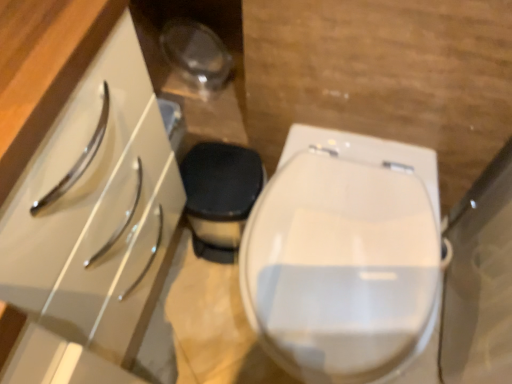
Question: From a real-world perspective, is white glossy toilet at center positioned above or below white glossy cabinet at left?

Choices:
 (A) above
 (B) below

Answer: (B)

Question: Visually, is white glossy toilet at center positioned to the left or to the right of white glossy cabinet at left?

Choices:
 (A) right
 (B) left

Answer: (A)

Question: Is point (376, 322) positioned closer to the camera than point (140, 94)?

Choices:
 (A) closer
 (B) farther

Answer: (B)

Question: Which is correct: white glossy cabinet at left is inside white glossy toilet at center, or outside of it?

Choices:
 (A) inside
 (B) outside

Answer: (B)

Question: Considering the positions of white glossy cabinet at left and white glossy toilet at center in the image, is white glossy cabinet at left taller or shorter than white glossy toilet at center?

Choices:
 (A) tall
 (B) short

Answer: (A)

Question: From a real-world perspective, is white glossy cabinet at left positioned above or below white glossy toilet at center?

Choices:
 (A) above
 (B) below

Answer: (A)

Question: From the image's perspective, is white glossy cabinet at left positioned above or below white glossy toilet at center?

Choices:
 (A) above
 (B) below

Answer: (A)